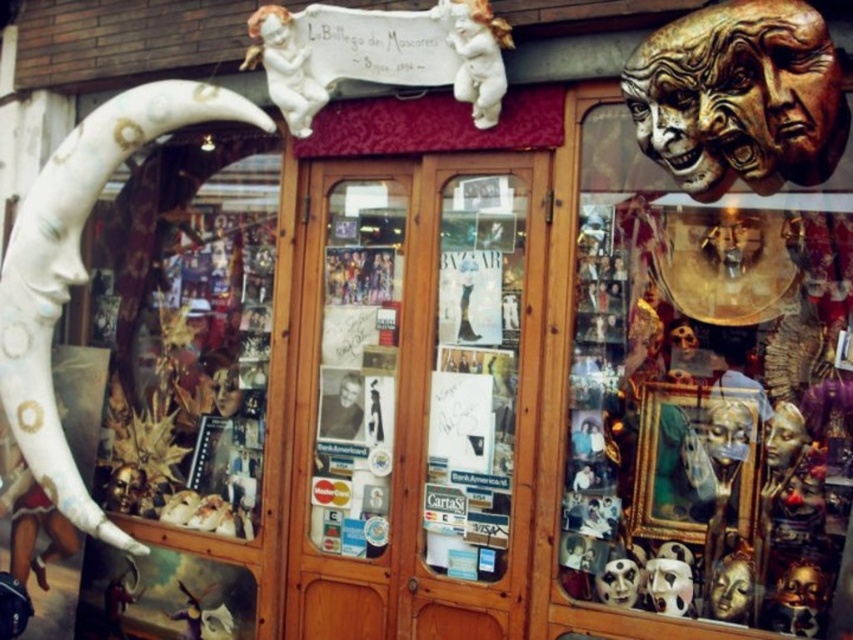
You are a delivery person carrying a box that is 1 meter wide. You need to pass through the entrance of the shop. Can you fit through the space between the wooden glass door at center and the white painted wood at left?

The wooden glass door at center and white painted wood at left are 98.42 centimeters apart from each other. Since the box is 1 meter wide, which is 100 centimeters, it will not fit through the space as it is slightly narrower than the box.

You are standing in front of the shop and want to enter. The wooden glass door at center is the only entrance. Can you reach the door without moving your feet?

The wooden glass door at center is 3.04 meters away from camera, so yes, you can reach the door without moving your feet since it is within arm reach.

You are a customer entering the shop and notice two gold masks displayed above the entrance. The gold metallic mask at upper center and the gold textured mask at upper right. Which one is located below the other?

The gold metallic mask at upper center is positioned under the gold textured mask at upper right, so the gold metallic mask at upper center is below the gold textured mask at upper right.